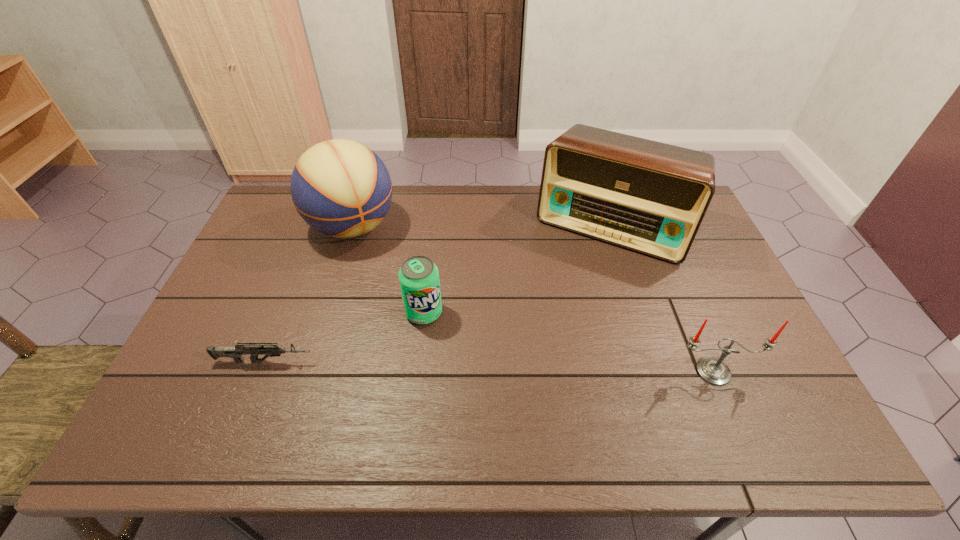
This screenshot has width=960, height=540. In order to click on vacant space at the near left corner of the desktop in this screenshot , I will do `click(230, 386)`.

In the image, there is a desktop. Identify the location of vacant area at the near right corner. This screenshot has width=960, height=540. tap(785, 382).

Find the location of a particular element. The height and width of the screenshot is (540, 960). empty space that is in between the shortest object and the pop soda is located at coordinates (345, 337).

I want to click on vacant space that's between the shortest object and the pop soda, so point(345,337).

Image resolution: width=960 pixels, height=540 pixels. Identify the location of free space between the radio receiver and the fourth tallest object. (517, 269).

At what (x,y) coordinates should I click in order to perform the action: click on vacant region between the candle and the third farthest object. Please return your answer as a coordinate pair (x, y). Looking at the image, I should click on (568, 342).

Where is `free spot between the basketball and the shortest object`? The height and width of the screenshot is (540, 960). free spot between the basketball and the shortest object is located at coordinates (309, 294).

I want to click on empty space that is in between the basketball and the candle, so click(533, 299).

Where is `vacant space in between the pop soda and the candle`? This screenshot has width=960, height=540. vacant space in between the pop soda and the candle is located at coordinates (568, 342).

Find the location of a particular element. This screenshot has height=540, width=960. vacant point located between the basketball and the third farthest object is located at coordinates (388, 270).